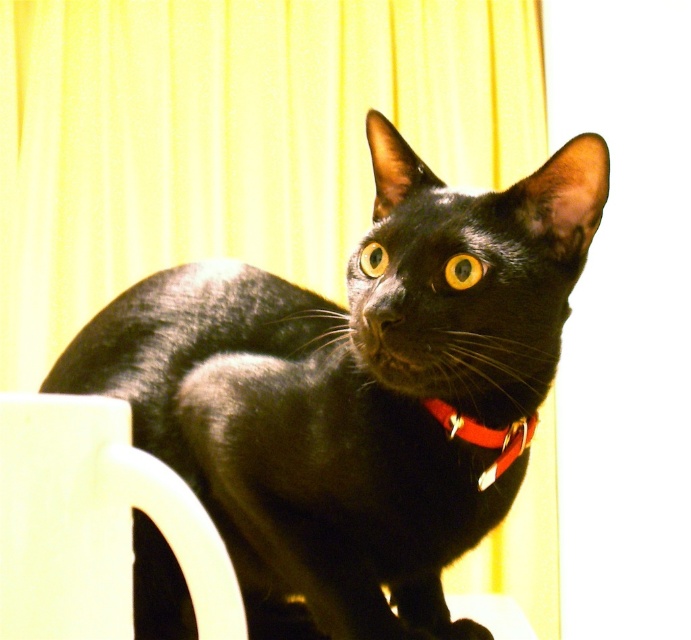
You are a photographer adjusting the camera focus. The camera has a focal point at point A and another at point B. The points are labeled as point A being point (424, 408) and point B being point (93, 189). If you want to focus on the object that is closer to the camera, which point should you choose?

Point A is in front of point B, so you should choose point A to focus on the object closer to the camera.

You are a photographer trying to capture a closeup shot of the shiny black cat at center. If your camera can focus on objects within 25 inches, will you need to adjust your position to get a clear photo?

The shiny black cat at center is 26.12 inches away from the viewer, which is slightly beyond the camera focus range of 25 inches. To get a clear photo, you need to move closer to reduce the distance between you and the shiny black cat at center.

You are taking a photo of a black cat with yellow eyes sitting on a light surface, wearing a red collar. There are two points marked in the image. The first point is at coordinates point (475, 458) and the second point is at point (227, 612). From your perspective as the photographer, which point is closer to you?

Point (227, 612) is closer to you because it is less further to the camera than point (475, 458).